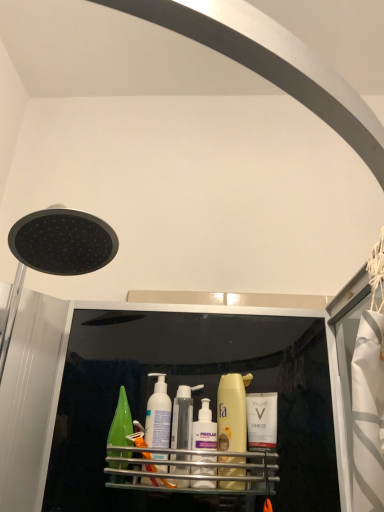
Question: From a real-world perspective, is metallic silver shelf at center on top of white matte vichy bottle at center, the 1th toiletry in the right-to-left sequence?

Choices:
 (A) yes
 (B) no

Answer: (B)

Question: Does metallic silver shelf at center appear on the right side of white matte vichy bottle at center, marked as the 3th toiletry in a left-to-right arrangement?

Choices:
 (A) yes
 (B) no

Answer: (B)

Question: Can you confirm if metallic silver shelf at center is bigger than white matte vichy bottle at center, the 1th toiletry in the right-to-left sequence?

Choices:
 (A) yes
 (B) no

Answer: (A)

Question: Is metallic silver shelf at center further to camera compared to white matte vichy bottle at center, marked as the 3th toiletry in a left-to-right arrangement?

Choices:
 (A) no
 (B) yes

Answer: (A)

Question: From the image's perspective, is metallic silver shelf at center on top of white matte vichy bottle at center, the 1th toiletry in the right-to-left sequence?

Choices:
 (A) no
 (B) yes

Answer: (A)

Question: Would you say metallic silver shelf at center is to the left or to the right of translucent plastic bottles at center, placed as the first toiletry when sorted from left to right, in the picture?

Choices:
 (A) right
 (B) left

Answer: (A)

Question: In the image, is metallic silver shelf at center positioned in front of or behind translucent plastic bottles at center, placed as the first toiletry when sorted from left to right?

Choices:
 (A) front
 (B) behind

Answer: (A)

Question: In terms of width, does metallic silver shelf at center look wider or thinner when compared to translucent plastic bottles at center, placed as the first toiletry when sorted from left to right?

Choices:
 (A) wide
 (B) thin

Answer: (A)

Question: Looking at the image, does metallic silver shelf at center seem bigger or smaller compared to translucent plastic bottles at center, the 3th toiletry in the right-to-left sequence?

Choices:
 (A) big
 (B) small

Answer: (A)

Question: Based on their sizes in the image, would you say white plastic pump bottle at center, marked as the 2th toiletry in a left-to-right arrangement, is bigger or smaller than white matte pump bottle at center, the second cleaning product positioned from the right?

Choices:
 (A) small
 (B) big

Answer: (A)

Question: Does point (193, 473) appear closer or farther from the camera than point (152, 374)?

Choices:
 (A) closer
 (B) farther

Answer: (A)

Question: From their relative heights in the image, would you say white plastic pump bottle at center, marked as the 2th toiletry in a left-to-right arrangement, is taller or shorter than white matte pump bottle at center, the first cleaning product from the left?

Choices:
 (A) tall
 (B) short

Answer: (B)

Question: From a real-world perspective, is white plastic pump bottle at center, the second toiletry from the right, above or below white matte pump bottle at center, the first cleaning product from the left?

Choices:
 (A) above
 (B) below

Answer: (B)

Question: Considering the positions of translucent plastic bottles at center, the 3th toiletry in the right-to-left sequence, and metallic silver shelf at center in the image, is translucent plastic bottles at center, the 3th toiletry in the right-to-left sequence, wider or thinner than metallic silver shelf at center?

Choices:
 (A) thin
 (B) wide

Answer: (A)

Question: From the image's perspective, is translucent plastic bottles at center, the 3th toiletry in the right-to-left sequence, above or below metallic silver shelf at center?

Choices:
 (A) above
 (B) below

Answer: (A)